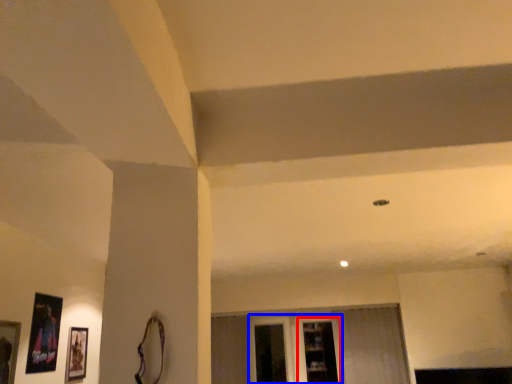
Question: Which of the following is the farthest to the observer, shelf (highlighted by a red box) or glass door (highlighted by a blue box)?

Choices:
 (A) shelf
 (B) glass door

Answer: (B)